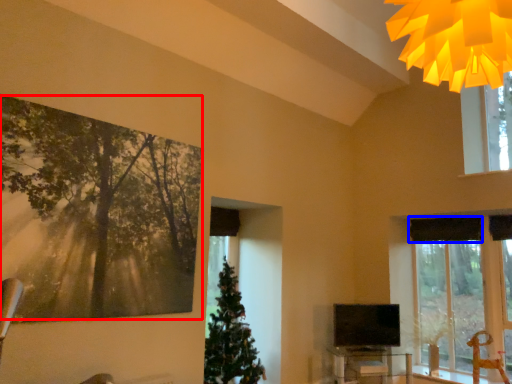
Question: Which point is further to the camera, tree (highlighted by a red box) or curtain (highlighted by a blue box)?

Choices:
 (A) tree
 (B) curtain

Answer: (B)